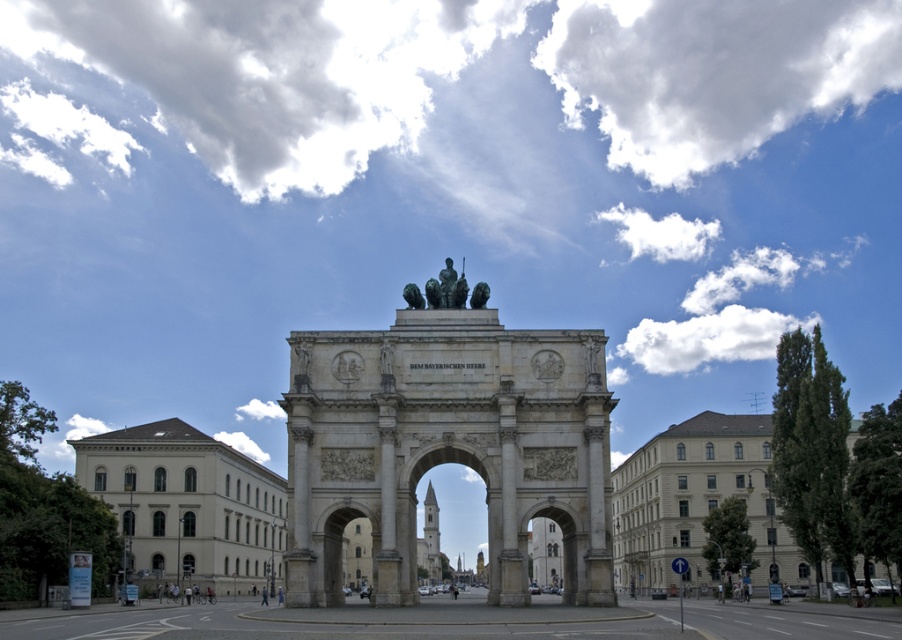
You are standing in front of the Siegestor in Munich and want to take a photo. You notice two points marked in the scene. The first point is at coordinates point (447,288), and the second is at point (422,307). Which point is closer to your camera when taking the photo?

Point (447,288) is further to the camera than point (422,307), so the second point is closer to the camera.